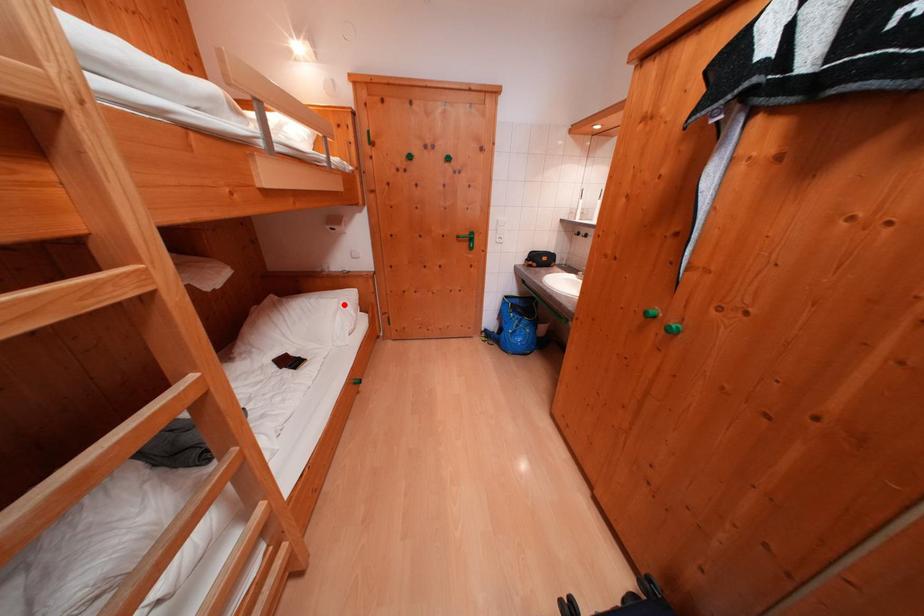
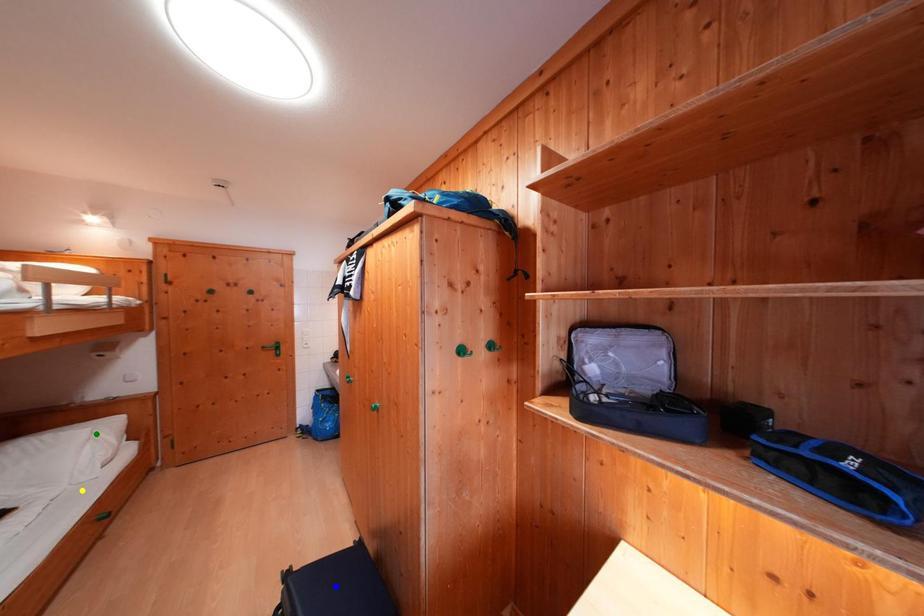
Question: I am providing you with two images of the same scene from different viewpoints. A red point is marked on the first image. You are given multiple points on the second image. In image 2, which mark is for the same physical point as the one in image 1?

Choices:
 (A) blue point
 (B) green point
 (C) yellow point

Answer: (B)